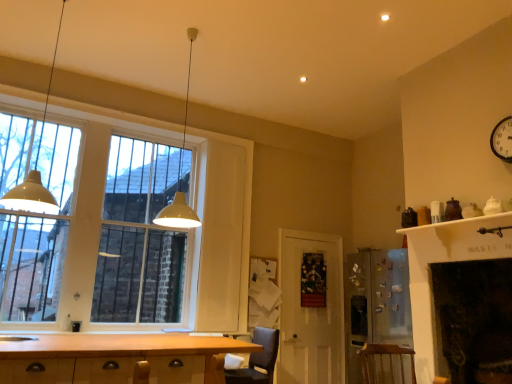
I want to click on free space above matte yellow pendant light at upper center, the 1th light fixture viewed from the right (from a real-world perspective), so point(186,35).